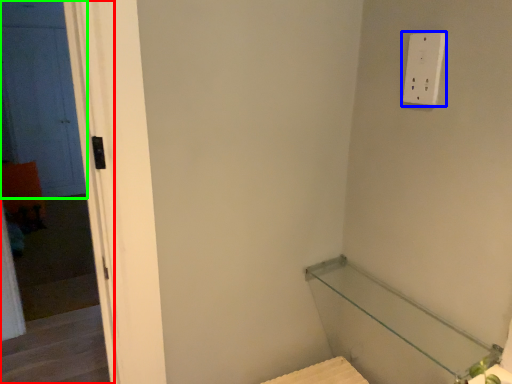
Question: Based on their relative distances, which object is nearer to screen door (highlighted by a red box)? Choose from light switch (highlighted by a blue box) and door (highlighted by a green box).

Choices:
 (A) light switch
 (B) door

Answer: (B)